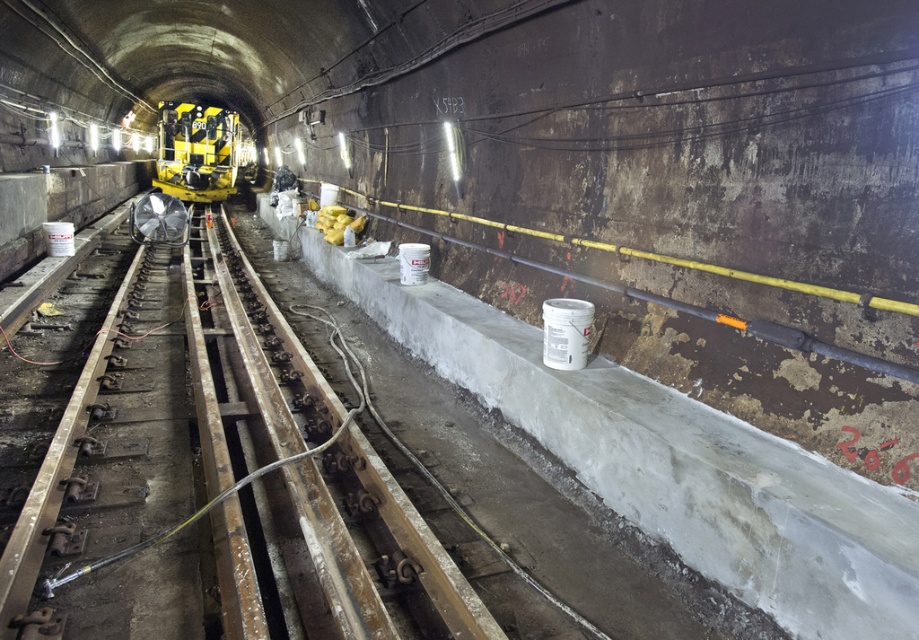
Question: Can you confirm if rusty metal train track at center is positioned to the left of yellow matte subway at center?

Choices:
 (A) yes
 (B) no

Answer: (B)

Question: Does rusty metal train track at center have a greater width compared to yellow matte subway at center?

Choices:
 (A) yes
 (B) no

Answer: (A)

Question: Which point is farther from the camera taking this photo?

Choices:
 (A) (214, 124)
 (B) (438, 570)

Answer: (A)

Question: Does rusty metal train track at center appear on the right side of yellow matte subway at center?

Choices:
 (A) yes
 (B) no

Answer: (A)